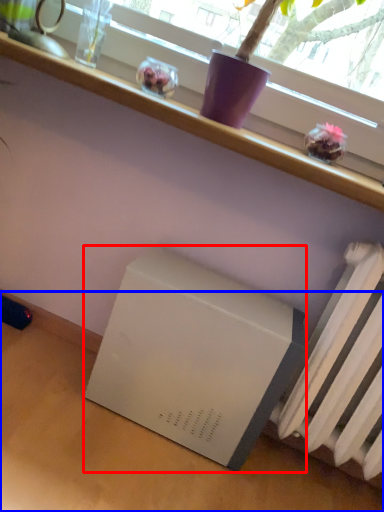
Question: Which object is closer to the camera taking this photo, appliance (highlighted by a red box) or table (highlighted by a blue box)?

Choices:
 (A) appliance
 (B) table

Answer: (B)